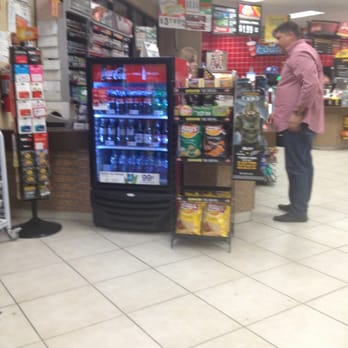
Find the location of a particular element. fluorescent ceiling light is located at coordinates (302, 14).